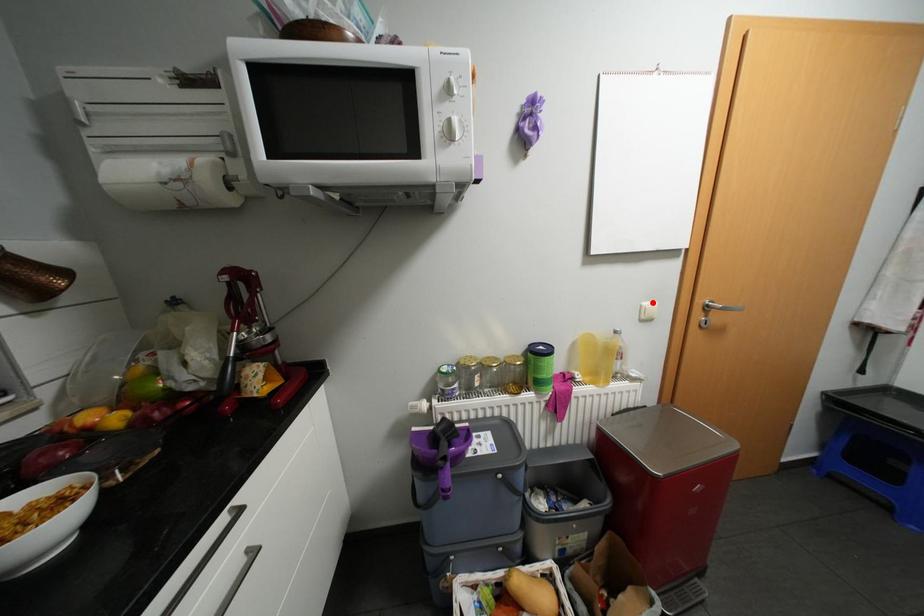
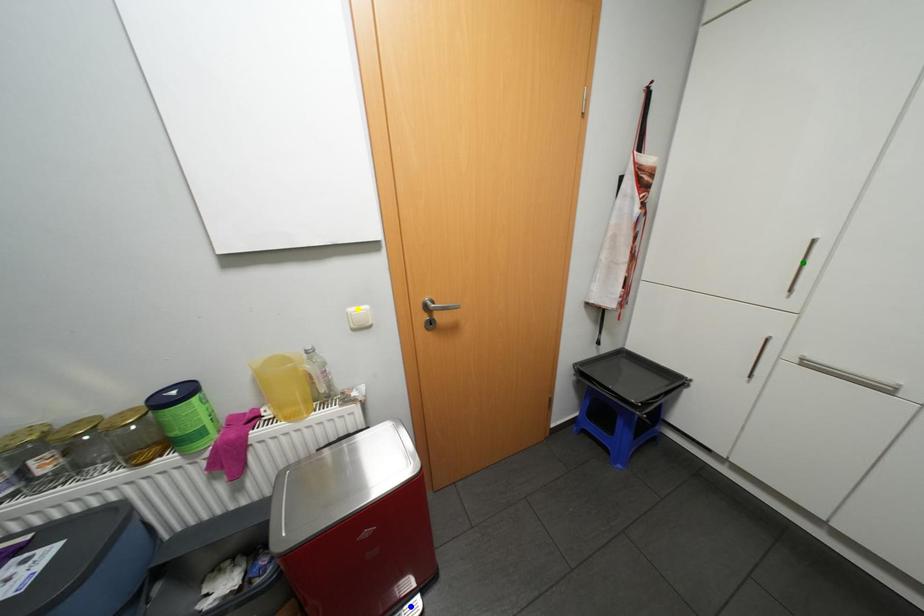
Question: I am providing you with two images of the same scene from different viewpoints. A red point is marked on the first image. You are given multiple points on the second image. Which point in image 2 represents the same 3d spot as the red point in image 1?

Choices:
 (A) blue point
 (B) green point
 (C) yellow point

Answer: (C)